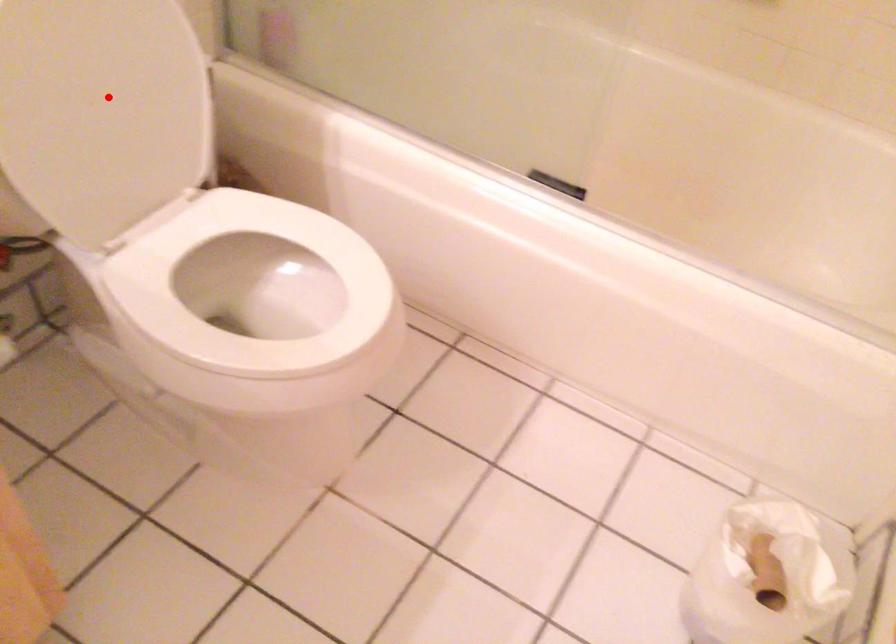
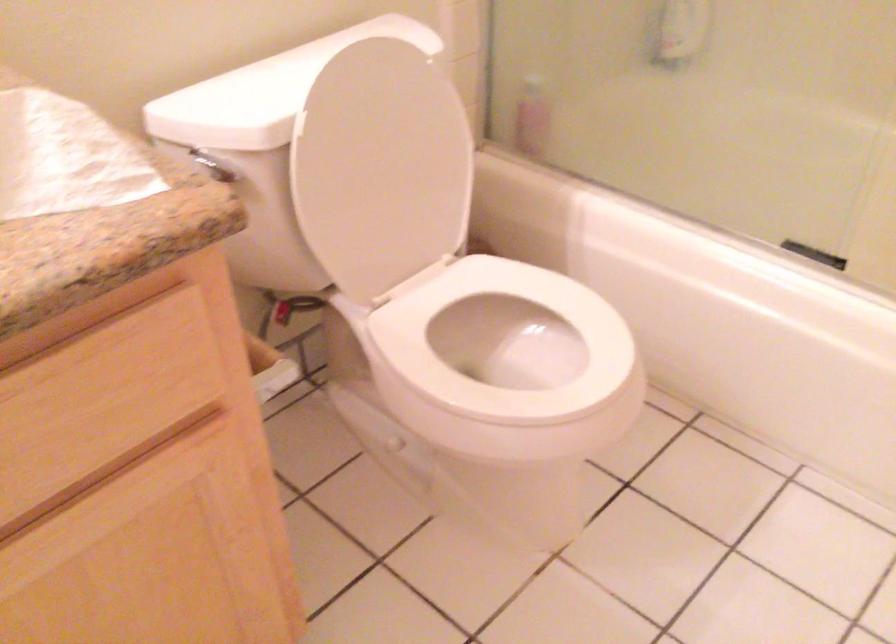
Question: A red point is marked in image1. In image2, is the corresponding 3D point closer to the camera or farther? Reply with the corresponding letter.

Choices:
 (A) The corresponding 3D point is closer.
 (B) The corresponding 3D point is farther.

Answer: (B)